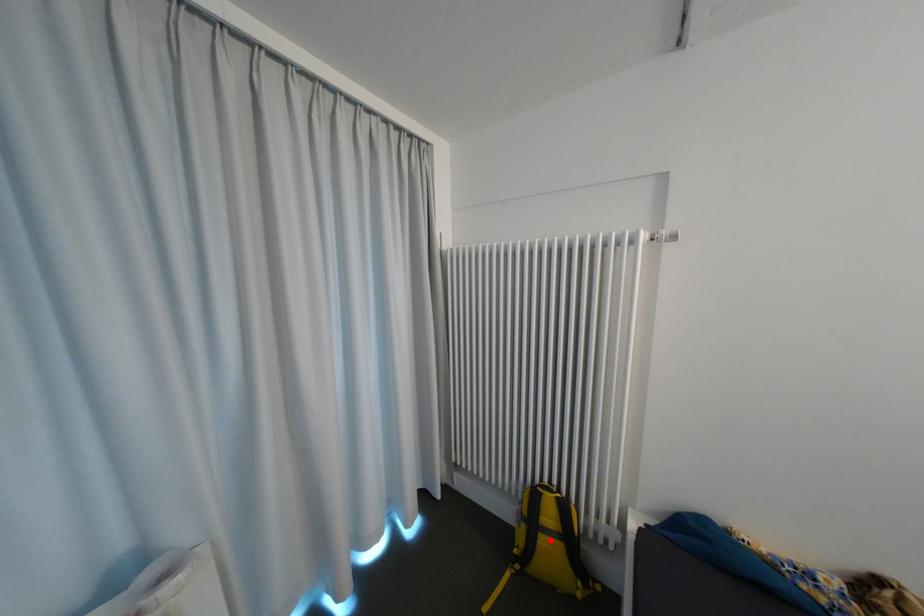
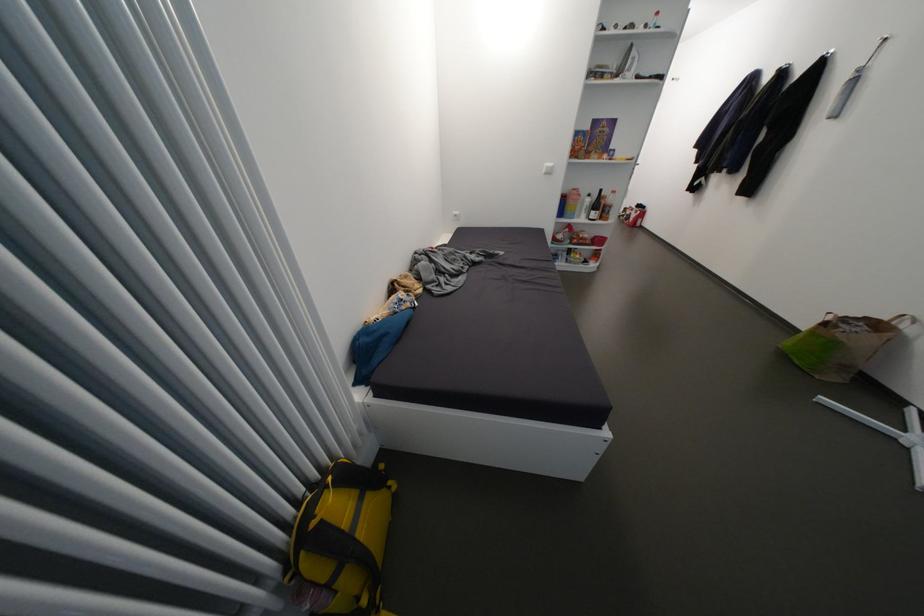
Where in the second image is the point corresponding to the highlighted location from the first image?

(370, 533)